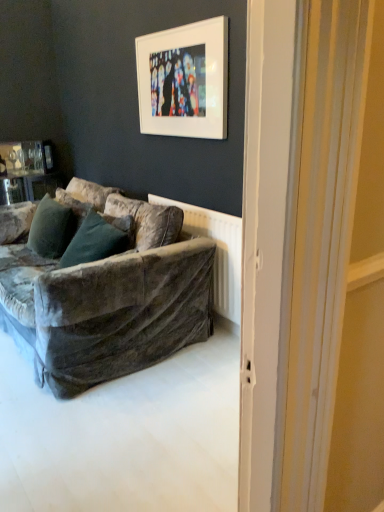
This screenshot has height=512, width=384. What do you see at coordinates (184, 80) in the screenshot?
I see `white matte picture frame at upper center` at bounding box center [184, 80].

At what (x,y) coordinates should I click in order to perform the action: click on white matte picture frame at upper center. Please return your answer as a coordinate pair (x, y). The image size is (384, 512). Looking at the image, I should click on (184, 80).

Locate an element on the screen. The image size is (384, 512). white matte picture frame at upper center is located at coordinates (184, 80).